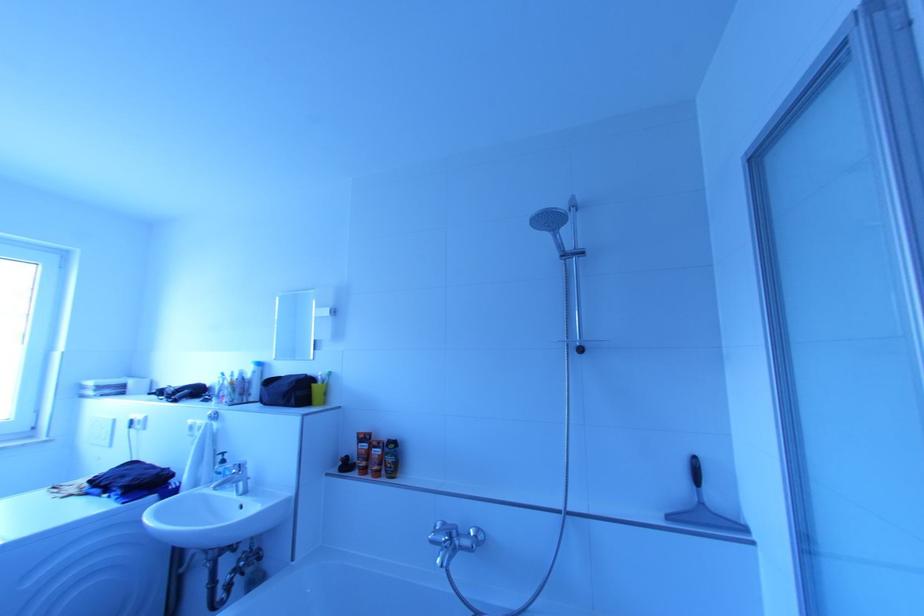
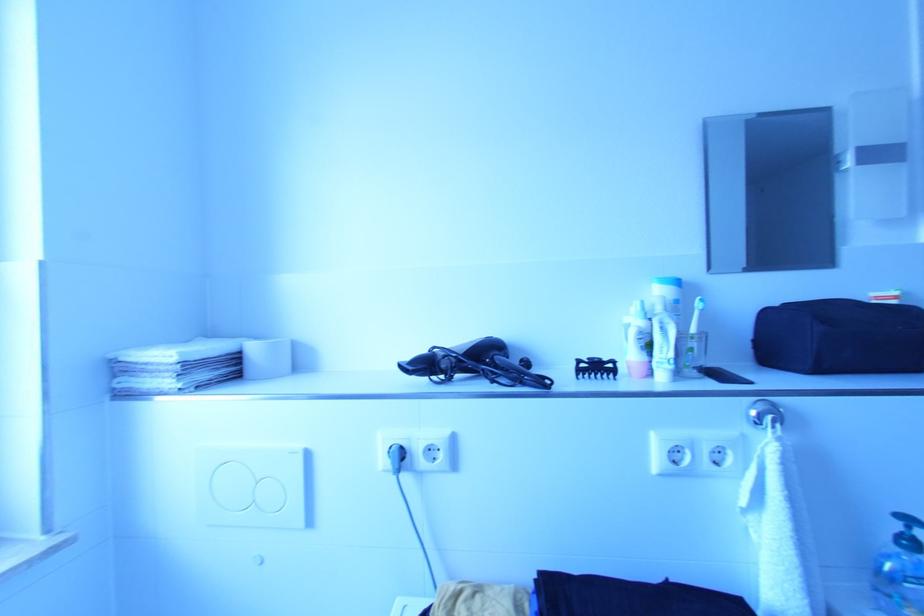
The images are taken continuously from a first-person perspective. In which direction are you moving?

The cameraman walked toward left, forward.